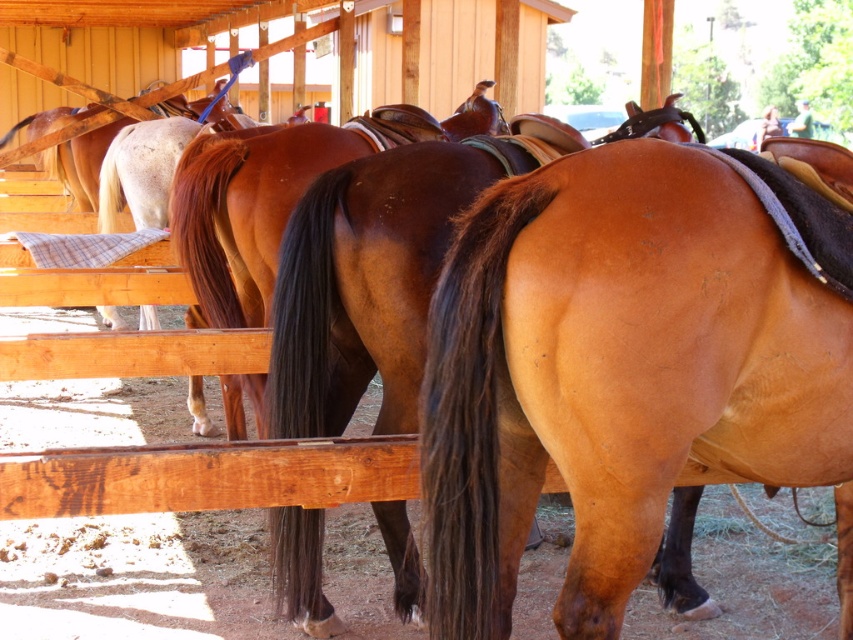
Does shiny brown horse at center have a lesser height compared to brown glossy horse at center?

No.

Based on the photo, which of these two, shiny brown horse at center or brown glossy horse at center, stands shorter?

With less height is brown glossy horse at center.

I want to click on shiny brown horse at center, so click(x=370, y=278).

Is saddle brown horse at center thinner than shiny brown horse at center?

Yes.

Can you confirm if saddle brown horse at center is smaller than shiny brown horse at center?

Yes, saddle brown horse at center is smaller than shiny brown horse at center.

Who is more forward, (453, 428) or (314, 320)?

Point (453, 428)

Locate an element on the screen. Image resolution: width=853 pixels, height=640 pixels. saddle brown horse at center is located at coordinates (618, 376).

Can you confirm if saddle brown horse at center is shorter than brown glossy horse at center?

Yes.

Does saddle brown horse at center have a lesser width compared to brown glossy horse at center?

Correct, saddle brown horse at center's width is less than brown glossy horse at center's.

The width and height of the screenshot is (853, 640). What do you see at coordinates (618, 376) in the screenshot? I see `saddle brown horse at center` at bounding box center [618, 376].

The width and height of the screenshot is (853, 640). Identify the location of saddle brown horse at center. (618, 376).